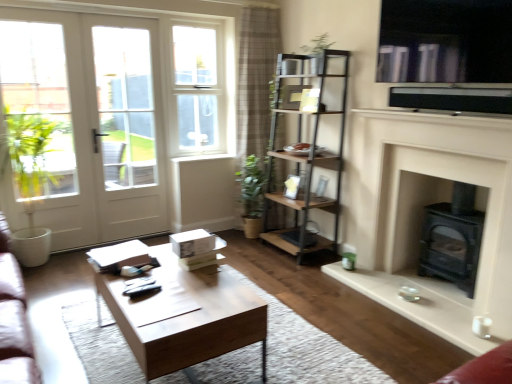
Question: Can you confirm if metallic brown shelf at center is bigger than black matte wood burning stove at lower right?

Choices:
 (A) no
 (B) yes

Answer: (B)

Question: Can you confirm if metallic brown shelf at center is wider than black matte wood burning stove at lower right?

Choices:
 (A) yes
 (B) no

Answer: (A)

Question: Considering the relative sizes of metallic brown shelf at center and black matte wood burning stove at lower right in the image provided, is metallic brown shelf at center shorter than black matte wood burning stove at lower right?

Choices:
 (A) no
 (B) yes

Answer: (A)

Question: Is black matte wood burning stove at lower right a part of metallic brown shelf at center?

Choices:
 (A) yes
 (B) no

Answer: (B)

Question: Could you tell me if metallic brown shelf at center is turned towards black matte wood burning stove at lower right?

Choices:
 (A) no
 (B) yes

Answer: (A)

Question: Would you say wooden coffee table at center is to the left or to the right of white matte fireplace at right in the picture?

Choices:
 (A) right
 (B) left

Answer: (B)

Question: Is wooden coffee table at center situated inside white matte fireplace at right or outside?

Choices:
 (A) outside
 (B) inside

Answer: (A)

Question: Looking at their shapes, would you say wooden coffee table at center is wider or thinner than white matte fireplace at right?

Choices:
 (A) thin
 (B) wide

Answer: (B)

Question: From the image's perspective, is wooden coffee table at center positioned above or below white matte fireplace at right?

Choices:
 (A) below
 (B) above

Answer: (A)

Question: Visually, is white matte fireplace at right positioned to the left or to the right of wooden coffee table at center?

Choices:
 (A) right
 (B) left

Answer: (A)

Question: Is white matte fireplace at right situated inside wooden coffee table at center or outside?

Choices:
 (A) outside
 (B) inside

Answer: (A)

Question: Does point pos(418,236) appear closer or farther from the camera than point pos(239,289)?

Choices:
 (A) closer
 (B) farther

Answer: (B)

Question: In terms of width, does white matte fireplace at right look wider or thinner when compared to wooden coffee table at center?

Choices:
 (A) wide
 (B) thin

Answer: (B)

Question: Looking at their shapes, would you say wooden coffee table at center is wider or thinner than metallic brown shelf at center?

Choices:
 (A) wide
 (B) thin

Answer: (A)

Question: Would you say wooden coffee table at center is to the left or to the right of metallic brown shelf at center in the picture?

Choices:
 (A) left
 (B) right

Answer: (A)